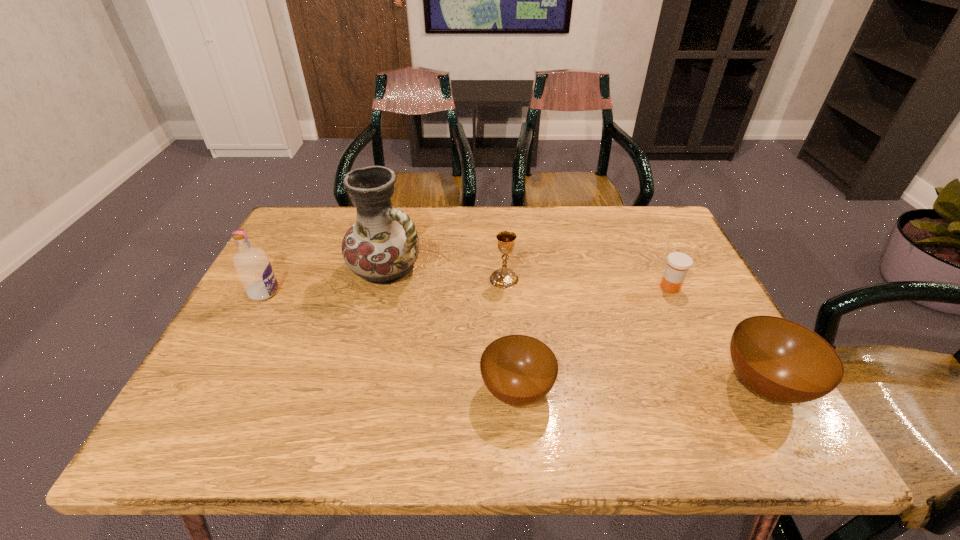
Please point out where to position a new bowl on the left to maintain spacing. Please provide its 2D coordinates. Your answer should be formatted as a tuple, i.e. [(x, y)], where the tuple contains the x and y coordinates of a point satisfying the conditions above.

[(263, 396)]